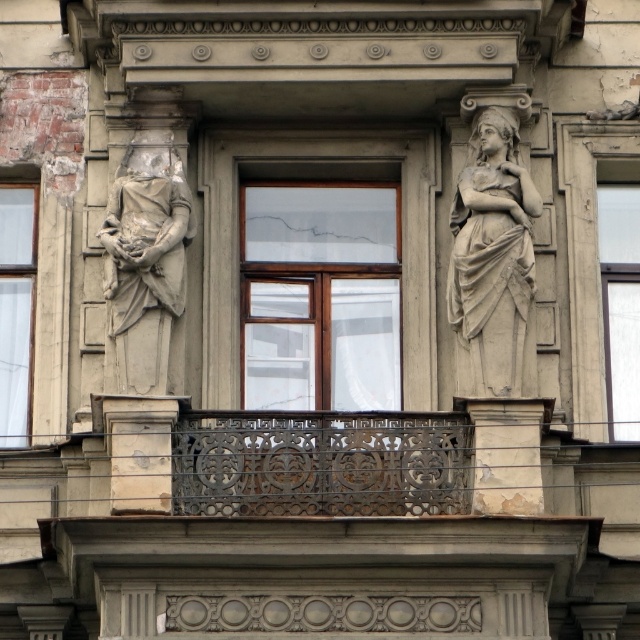
Question: Which object is the farthest from the gray stone statue at left?

Choices:
 (A) wooden frame at center
 (B) white plaster column at center
 (C) white glass window at left

Answer: (B)

Question: Which of the following is the closest to the observer?

Choices:
 (A) (196, 426)
 (B) (3, 284)
 (C) (474, 125)
 (D) (120, 387)

Answer: (A)

Question: Is wooden frame at center positioned behind transparent glass window at right?

Choices:
 (A) no
 (B) yes

Answer: (B)

Question: Is wooden frame at center above gray stone statue at right?

Choices:
 (A) yes
 (B) no

Answer: (B)

Question: Can you confirm if rusted metal balcony at center is positioned above wooden frame at center?

Choices:
 (A) no
 (B) yes

Answer: (A)

Question: Which point is farther to the camera?

Choices:
 (A) (624, 344)
 (B) (496, 332)
 (C) (176, 316)

Answer: (A)